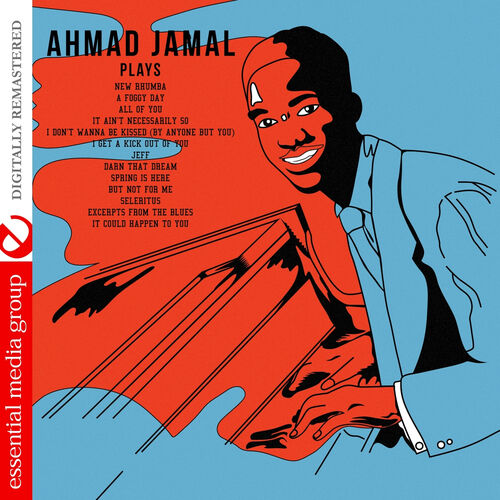
I want to click on animated piano ets, so click(291, 450), click(288, 402).